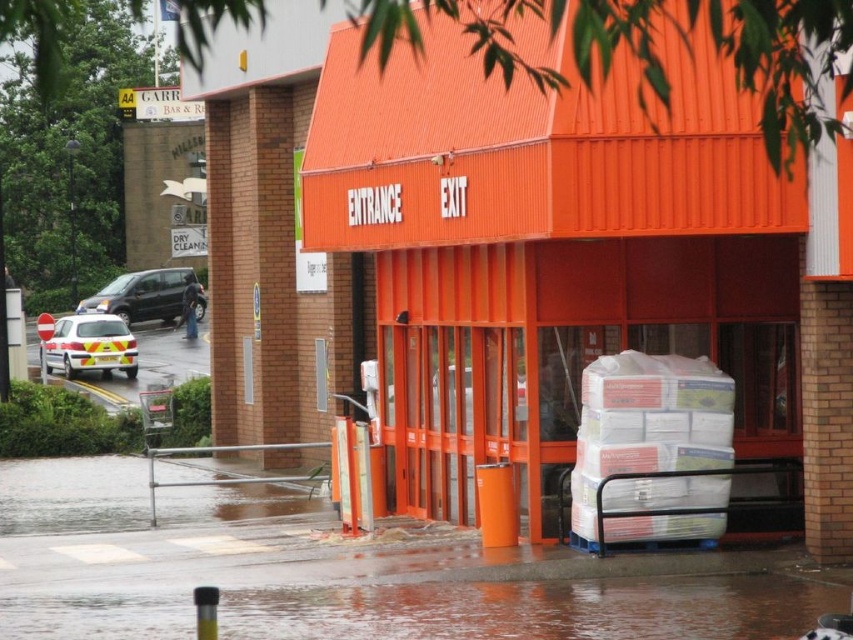
You are a delivery person approaching the store entrance. You see the yellow reflective plastic ambulance at left and the matte black suv at left. Which object is closer to the ground?

The yellow reflective plastic ambulance at left is located below the matte black suv at left, so it is closer to the ground.

You are a delivery person trying to avoid getting your shoes wet. You see the wet concrete flood at lower center and the yellow reflective plastic ambulance at left. Which area should you step on to stay dry?

The yellow reflective plastic ambulance at left is larger than the wet concrete flood at lower center, so stepping on the yellow reflective plastic ambulance at left would keep your shoes dry.

You are standing at the store entrance and see two points marked on the wet ground. One is point [445,621] and the other is point [107,356]. If you want to walk towards the point that is closer to the entrance, which point should you head towards?

Point [107,356] is closer to the entrance because it is behind point [445,621], meaning it is nearer to your current position at the entrance.